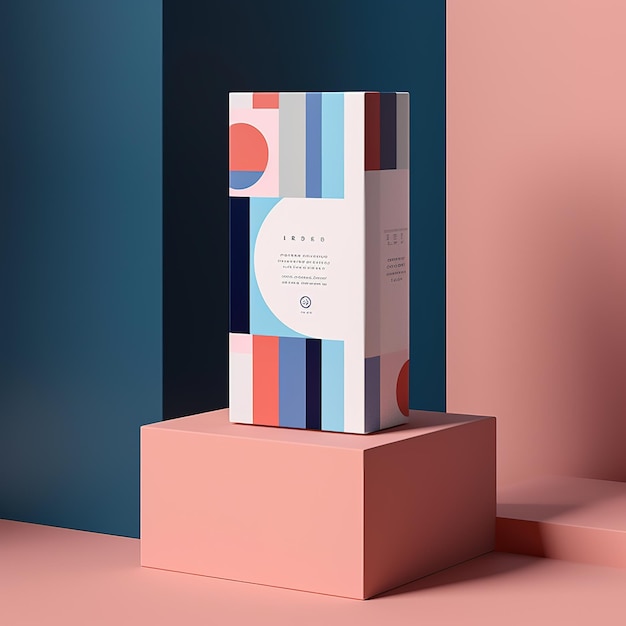
At what (x,y) coordinates should I click in order to perform the action: click on pink floor. Please return your answer as a coordinate pair (x, y). The image size is (626, 626). Looking at the image, I should click on (451, 591).